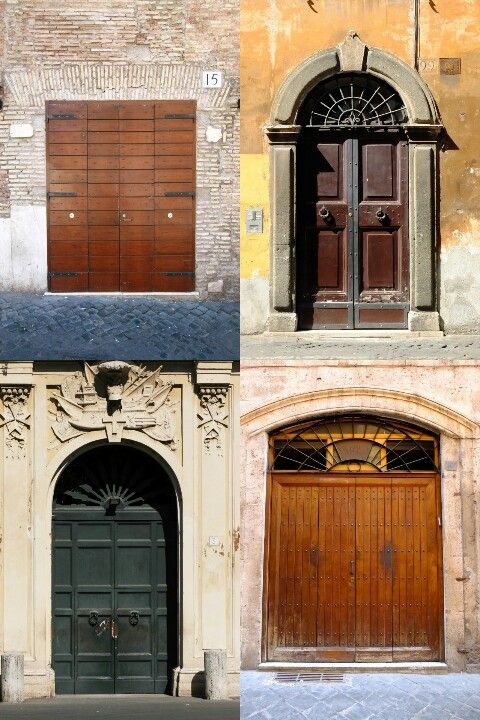
Find the location of a particular element. door hinges is located at coordinates (54, 114), (55, 191), (60, 273), (181, 114), (181, 191), (177, 273).